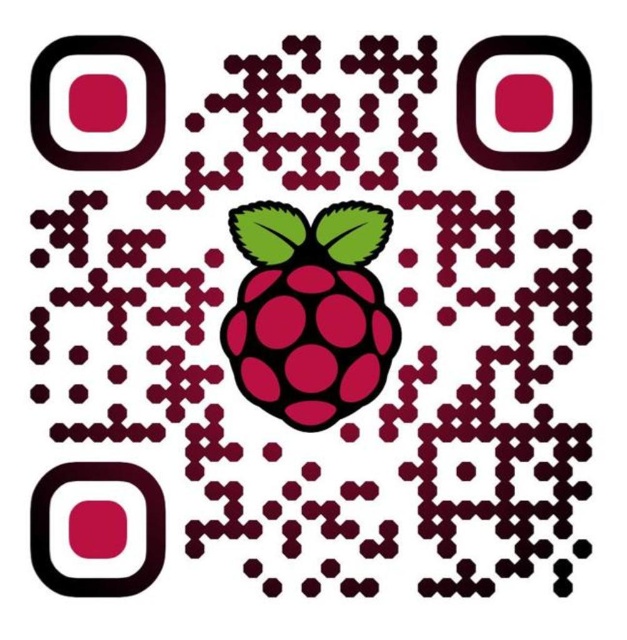
Does matte black square at upper left have a lesser height compared to matte black square at upper right?

Yes, matte black square at upper left is shorter than matte black square at upper right.

Can you confirm if matte black square at upper left is positioned to the right of matte black square at upper right?

No, matte black square at upper left is not to the right of matte black square at upper right.

Who is more distant from viewer, [127,42] or [470,125]?

Positioned behind is point [470,125].

Where is `matte black square at upper left`? Image resolution: width=627 pixels, height=640 pixels. matte black square at upper left is located at coordinates (145, 102).

Is matte red raspberry at center to the left of matte black square at upper left from the viewer's perspective?

No, matte red raspberry at center is not to the left of matte black square at upper left.

Between point (345, 216) and point (51, 140), which one is positioned behind?

The point (345, 216) is more distant.

Where is `matte red raspberry at center`? The image size is (627, 640). matte red raspberry at center is located at coordinates (308, 310).

Can you confirm if matte black square at bottom left is bigger than matte black square at upper left?

Indeed, matte black square at bottom left has a larger size compared to matte black square at upper left.

Is matte black square at bottom left behind matte black square at upper left?

No.

At what (x,y) coordinates should I click in order to perform the action: click on matte black square at bottom left. Please return your answer as a coordinate pair (x, y). Looking at the image, I should click on (145, 529).

I want to click on matte black square at bottom left, so click(x=145, y=529).